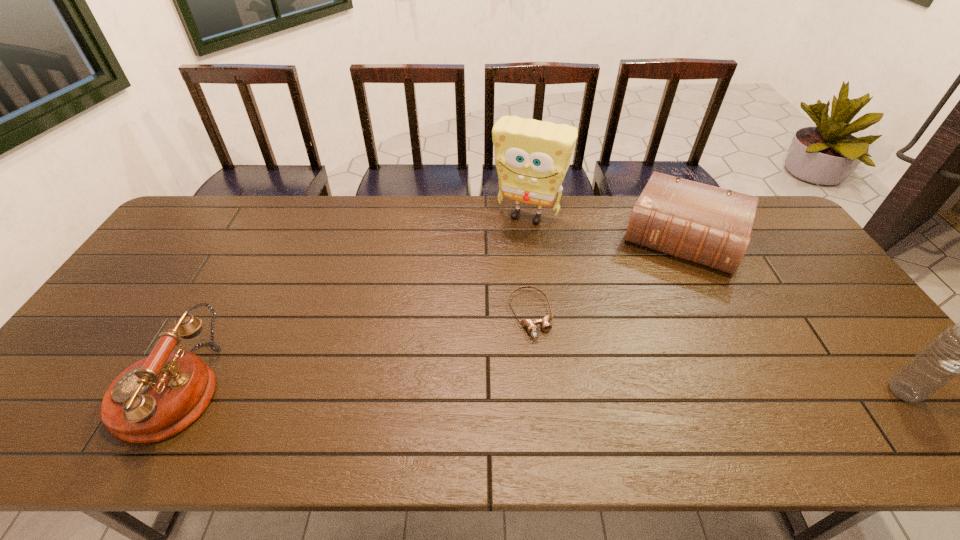
Locate an element on the screen. This screenshot has width=960, height=540. free spot between the tallest object and the telephone is located at coordinates (349, 303).

What are the coordinates of `free space between the third tallest object and the Bible` in the screenshot? It's located at (427, 314).

Identify the location of free space between the second shortest object and the sponge. (605, 227).

This screenshot has height=540, width=960. I want to click on object that is the second closest to the Bible, so click(x=530, y=325).

Select which object appears as the third closest to the goggles. Please provide its 2D coordinates. Your answer should be formatted as a tuple, i.e. [(x, y)], where the tuple contains the x and y coordinates of a point satisfying the conditions above.

[(157, 397)]

Locate an element on the screen. vacant space that satisfies the following two spatial constraints: 1. on the back side of the Bible; 2. on the right side of the goggles is located at coordinates (522, 239).